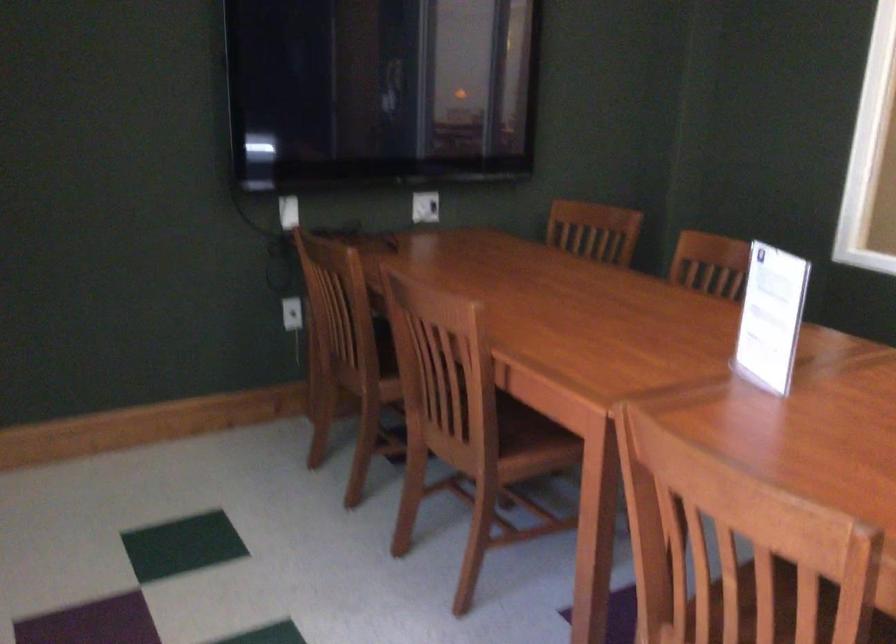
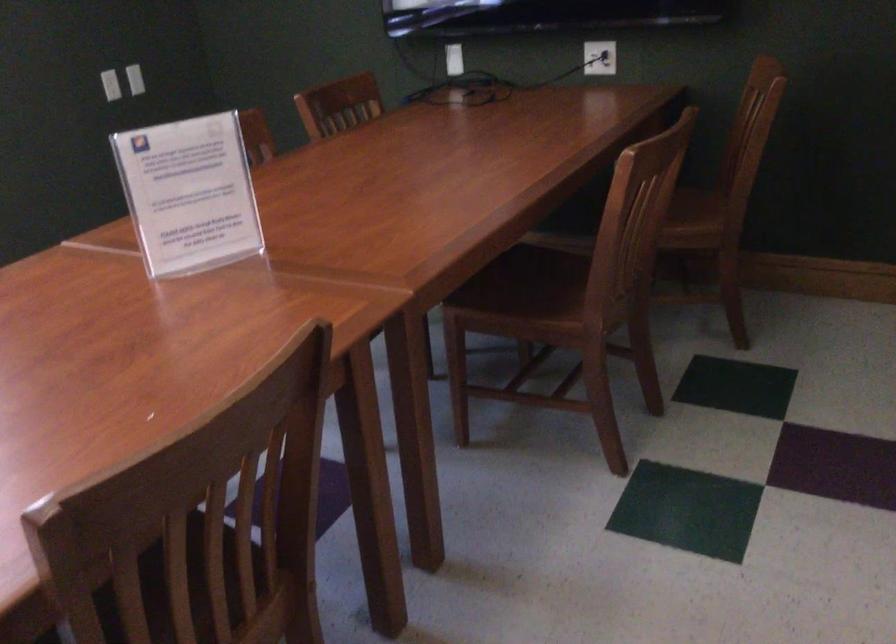
The point at (755, 310) is marked in the first image. Where is the corresponding point in the second image?

(188, 194)